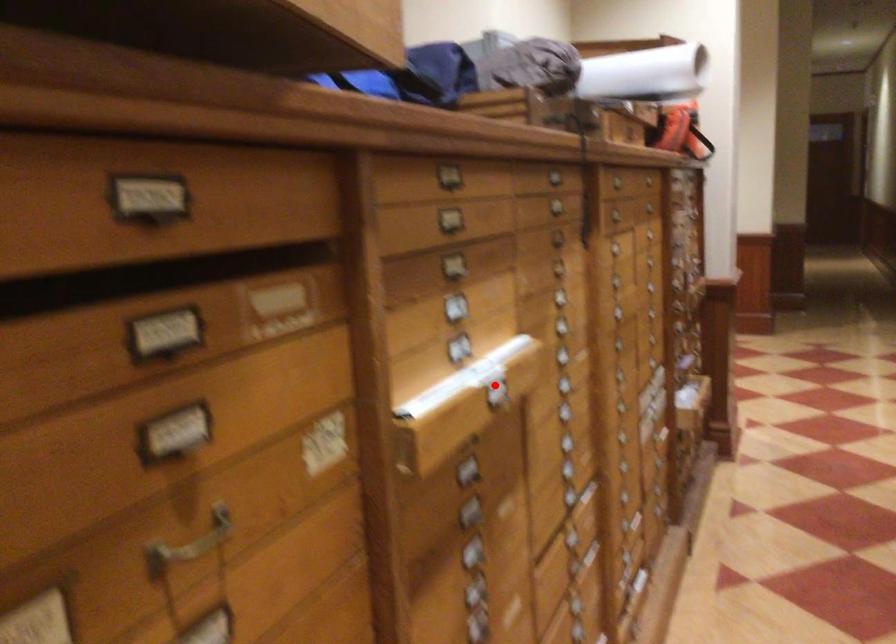
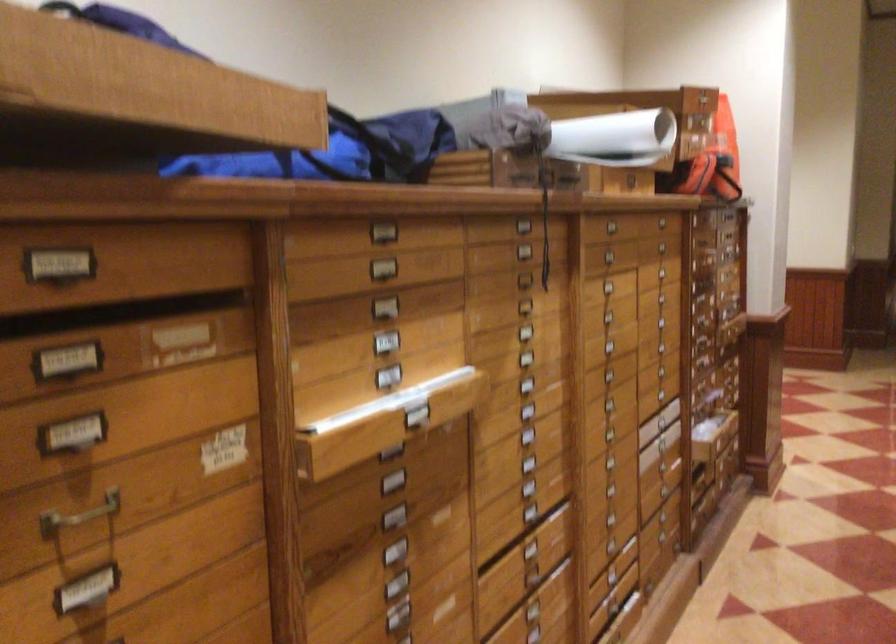
Locate, in the second image, the point that corresponds to the highlighted location in the first image.

(416, 411)